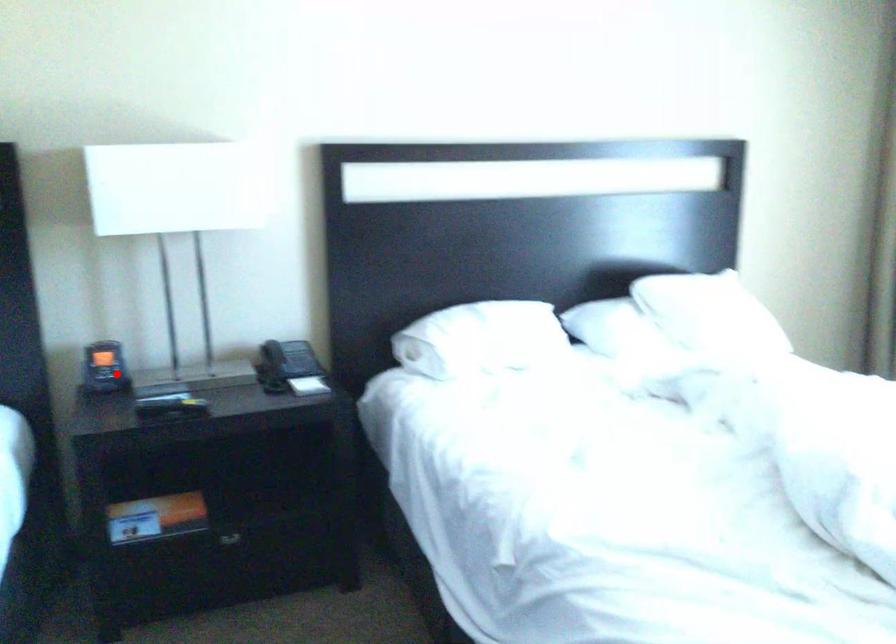
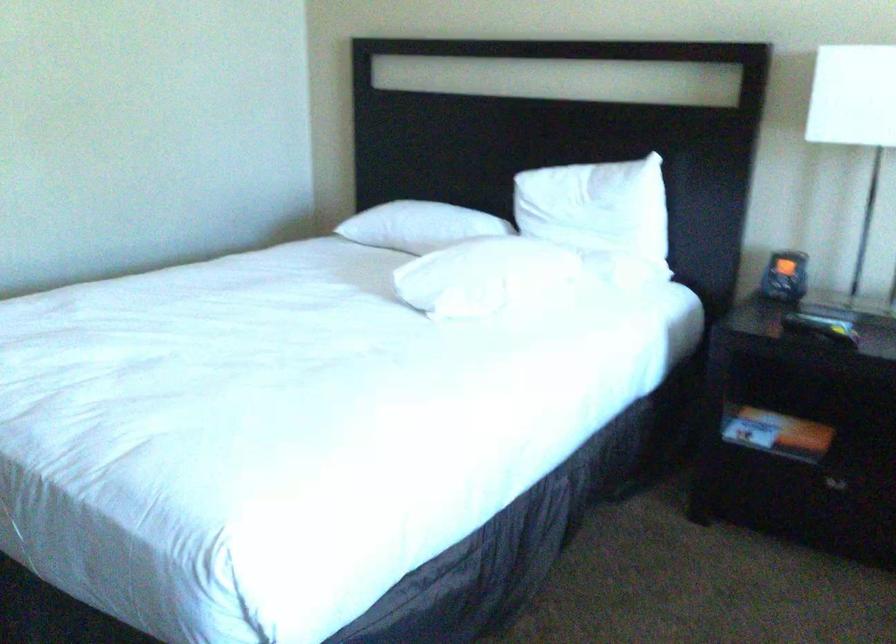
The point at the highlighted location is marked in the first image. Where is the corresponding point in the second image?

(785, 276)